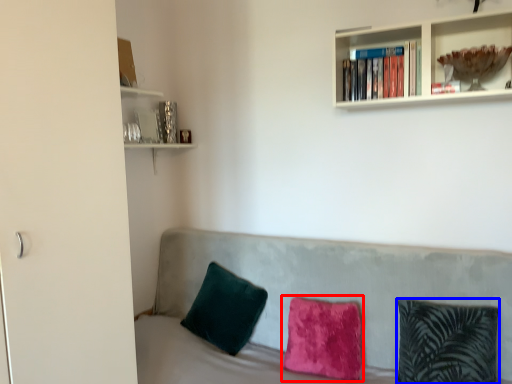
Question: Which of the following is the closest to the observer, pillow (highlighted by a red box) or pillow (highlighted by a blue box)?

Choices:
 (A) pillow
 (B) pillow

Answer: (B)